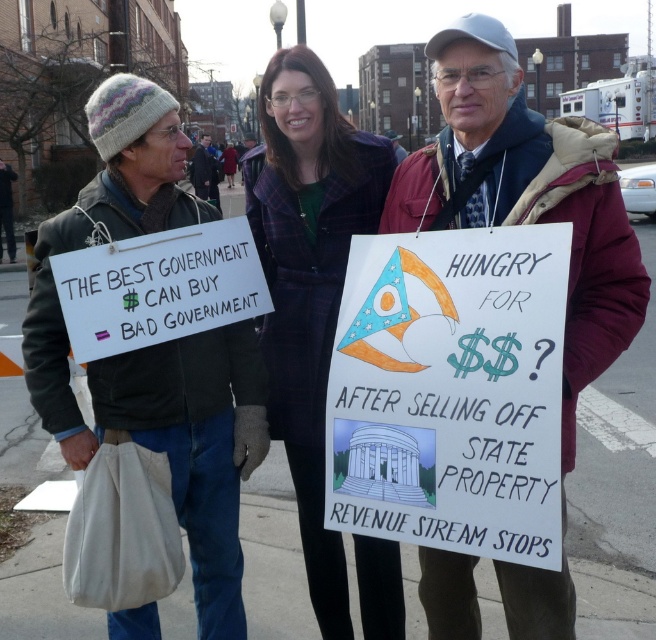
You are a photographer trying to capture a clear shot of both the knit wool hat at upper left and the maroon woolen jacket at center. Given their sizes, which object should you focus on first to ensure it doesn t get cropped out of the frame?

The knit wool hat at upper left occupies less space than the maroon woolen jacket at center, so you should focus on capturing the smaller knit wool hat at upper left first to prevent it from being cropped out of the frame.

Based on the photo, you are a photographer trying to capture the knit wool hat at upper left and the white paper sign at left in the same frame. Based on their sizes, do you think both can fit side by side without overlapping?

The knit wool hat at upper left might be wider than white paper sign at left, so there is a possibility they could overlap if placed side by side. Adjust the camera angle or position to ensure both fit without overlapping.

Based on the photo, which object is located at the coordinates point (x=154, y=348)?

The knit wool hat at upper left is located at point (x=154, y=348).